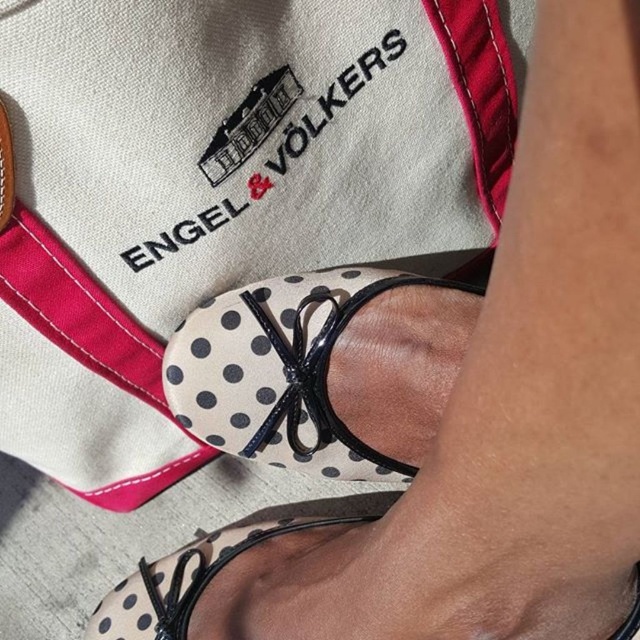
Based on the photo, does white dotted fabric sandal at center have a lesser width compared to white dotted fabric at lower center?

Yes.

Can you confirm if white dotted fabric sandal at center is taller than white dotted fabric at lower center?

Yes.

Where is `white dotted fabric sandal at center`? white dotted fabric sandal at center is located at coordinates [x=280, y=371].